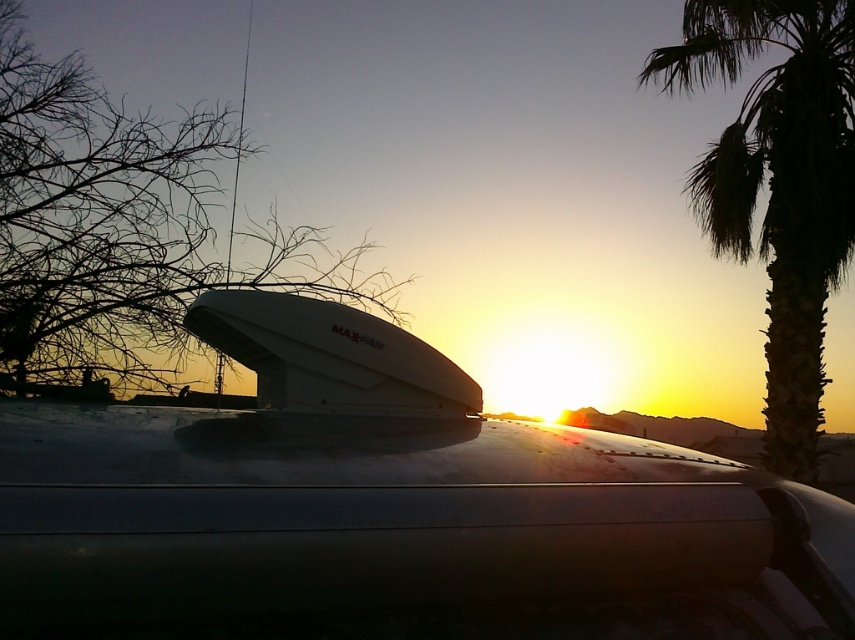
Question: Which object is farther from the camera taking this photo?

Choices:
 (A) bare branches at upper left
 (B) green leafy palm tree at right

Answer: (B)

Question: Can you confirm if bare branches at upper left is thinner than green leafy palm tree at right?

Choices:
 (A) yes
 (B) no

Answer: (B)

Question: Does bare branches at upper left have a greater width compared to green leafy palm tree at right?

Choices:
 (A) no
 (B) yes

Answer: (B)

Question: Which point is closer to the camera?

Choices:
 (A) bare branches at upper left
 (B) green leafy palm tree at right

Answer: (A)

Question: Where is bare branches at upper left located in relation to green leafy palm tree at right in the image?

Choices:
 (A) left
 (B) right

Answer: (A)

Question: Which point is farther to the camera?

Choices:
 (A) green leafy palm tree at right
 (B) bare branches at upper left

Answer: (A)